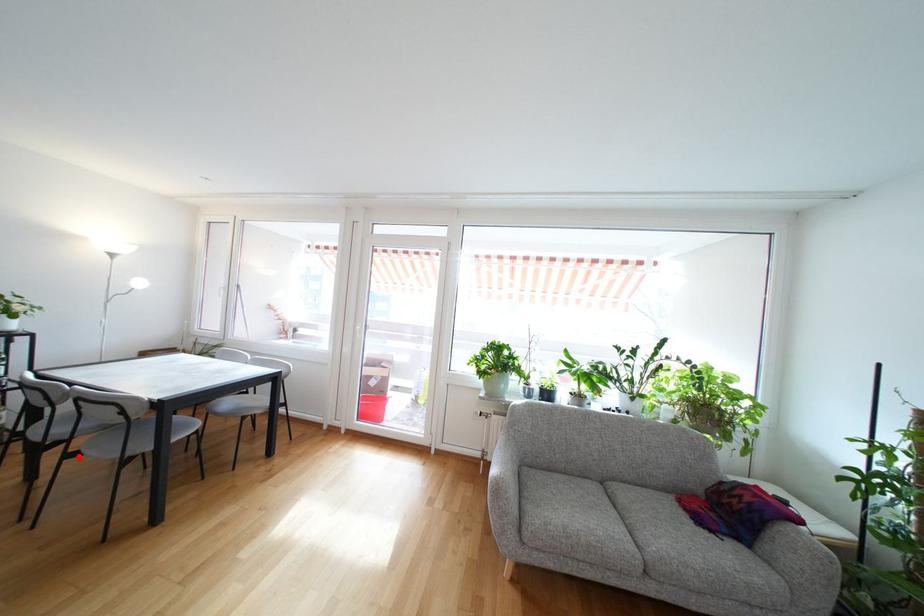
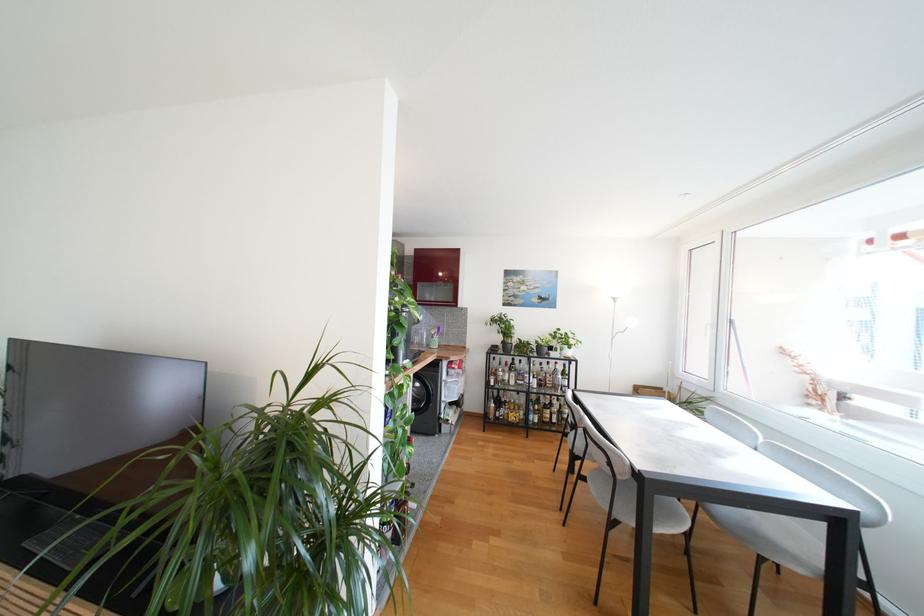
Where in the second image is the point corresponding to the highlighted location from the first image?

(589, 480)